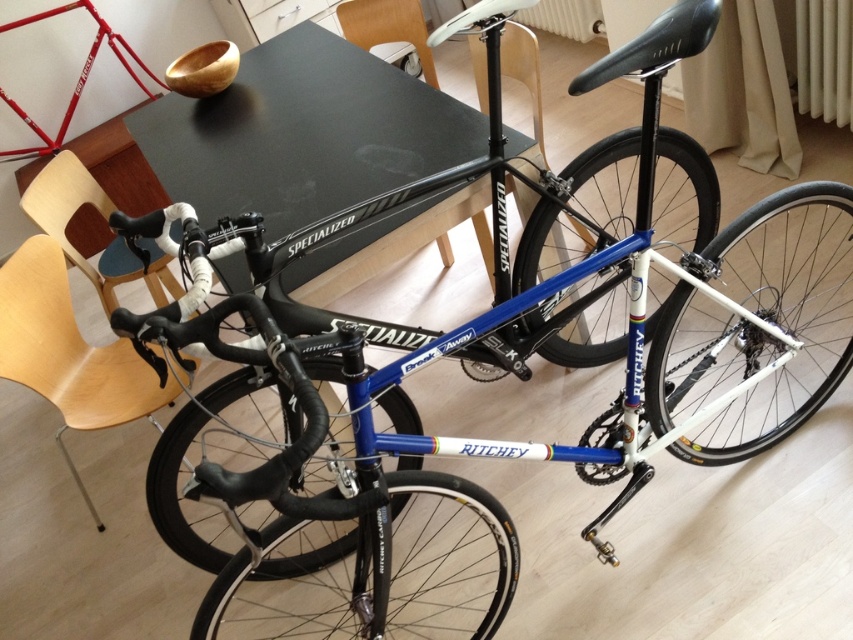
Question: Which object is closer to the camera taking this photo?

Choices:
 (A) wooden chair at left
 (B) black matte table at upper center
 (C) light wood chair at lower left

Answer: (B)

Question: Is light wood chair at lower left wider than wooden chair at left?

Choices:
 (A) no
 (B) yes

Answer: (B)

Question: Can you confirm if black matte table at upper center is positioned above light wood chair at lower left?

Choices:
 (A) no
 (B) yes

Answer: (B)

Question: Is wooden chair at center to the left of wooden chair at upper center from the viewer's perspective?

Choices:
 (A) yes
 (B) no

Answer: (B)

Question: Which point is closer to the camera?

Choices:
 (A) (260, 54)
 (B) (352, 1)

Answer: (A)

Question: Which object is the farthest from the wooden chair at left?

Choices:
 (A) wooden chair at upper center
 (B) wooden chair at center
 (C) light wood chair at lower left
 (D) black matte table at upper center

Answer: (B)